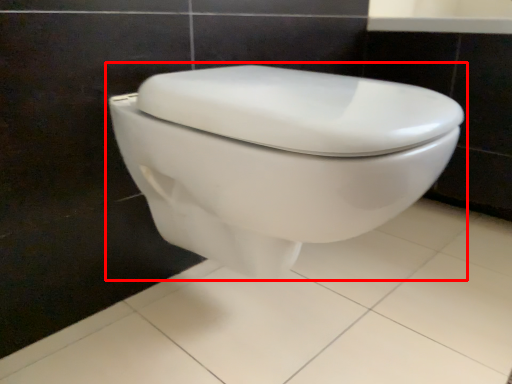
Question: Where is toilet (annotated by the red box) located in relation to porcelain in the image?

Choices:
 (A) left
 (B) right

Answer: (A)